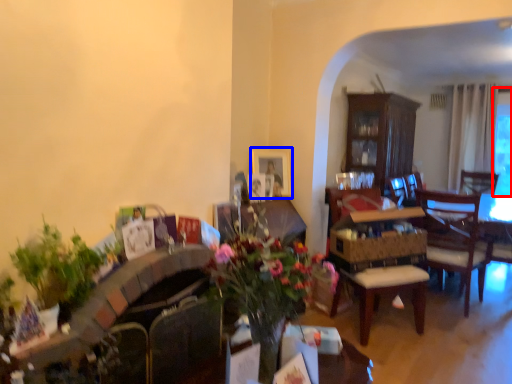
Question: Among these objects, which one is nearest to the camera, window screen (highlighted by a red box) or picture frame (highlighted by a blue box)?

Choices:
 (A) window screen
 (B) picture frame

Answer: (B)